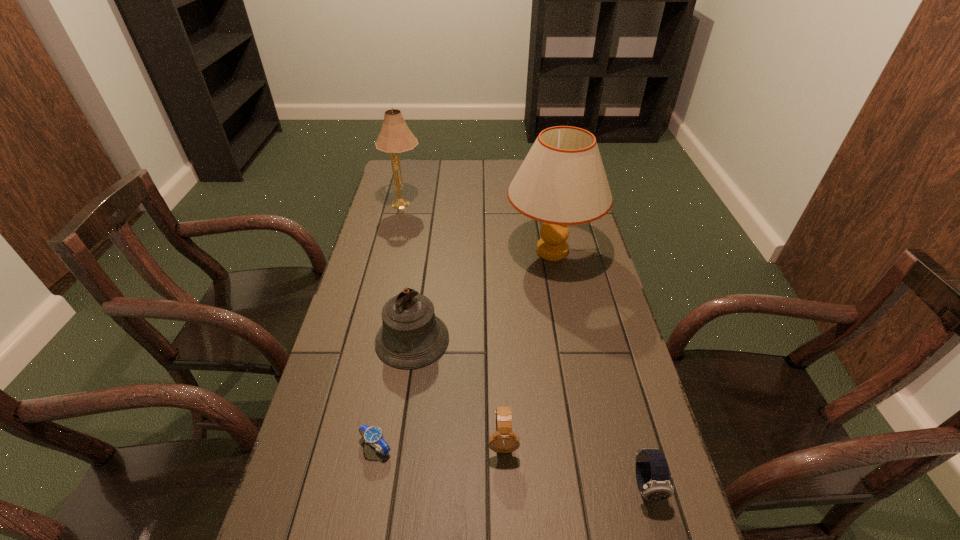
This screenshot has height=540, width=960. In order to click on vacant region between the left lampshade and the rightmost watch in this screenshot , I will do `click(525, 345)`.

Identify the location of vacant space that is in between the second watch from right to left and the nearest watch. click(x=574, y=463).

The width and height of the screenshot is (960, 540). I want to click on free space between the nearer lampshade and the nearest object, so click(x=599, y=368).

Image resolution: width=960 pixels, height=540 pixels. Identify the location of object that stands as the second closest to the shortest object. (504, 440).

Select which object is the fifth closest to the fourth nearest object. Please provide its 2D coordinates. Your answer should be formatted as a tuple, i.e. [(x, y)], where the tuple contains the x and y coordinates of a point satisfying the conditions above.

[(395, 137)]

At what (x,y) coordinates should I click in order to perform the action: click on watch that is the closest one to the farthest object. Please return your answer as a coordinate pair (x, y). Looking at the image, I should click on (373, 435).

Locate an element on the screen. This screenshot has width=960, height=540. the second closest watch to the third farthest object is located at coordinates (504, 440).

Identify the location of free space that satisfies the following two spatial constraints: 1. on the front side of the bell; 2. on the left side of the farther lampshade. (373, 340).

I want to click on vacant space that satisfies the following two spatial constraints: 1. on the front side of the farther lampshade; 2. on the left side of the fourth nearest object, so click(x=373, y=340).